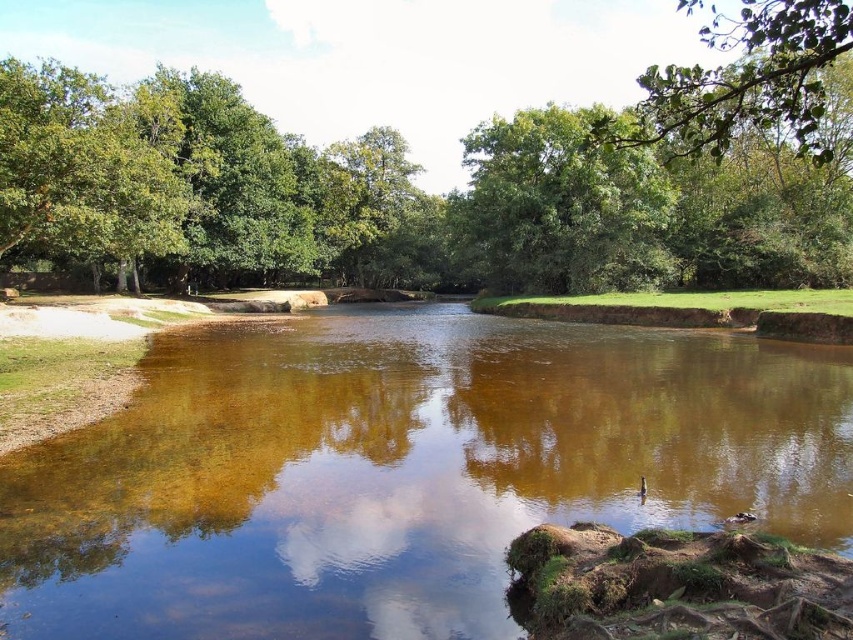
Can you confirm if clear water at center is bigger than green leafy branch at upper right?

Incorrect, clear water at center is not larger than green leafy branch at upper right.

Can you confirm if clear water at center is thinner than green leafy branch at upper right?

Correct, clear water at center's width is less than green leafy branch at upper right's.

Which is in front, point (16, 556) or point (706, 32)?

Positioned in front is point (16, 556).

Locate an element on the screen. clear water at center is located at coordinates (403, 470).

Is point (558, 268) closer to viewer compared to point (631, 140)?

No, (558, 268) is behind (631, 140).

In the scene shown: Can you confirm if green leafy tree at upper center is smaller than green leafy branch at upper right?

Yes, green leafy tree at upper center is smaller than green leafy branch at upper right.

Is point (611, 160) positioned in front of point (817, 93)?

That is False.

This screenshot has height=640, width=853. Find the location of `green leafy tree at upper center`. green leafy tree at upper center is located at coordinates (561, 208).

Can you confirm if clear water at center is positioned to the right of green leafy tree at upper center?

In fact, clear water at center is to the left of green leafy tree at upper center.

Who is positioned more to the right, clear water at center or green leafy tree at upper center?

green leafy tree at upper center is more to the right.

Measure the distance between point (494, 442) and camera.

Point (494, 442) and camera are 11.32 meters apart from each other.

Identify the location of clear water at center. (403, 470).